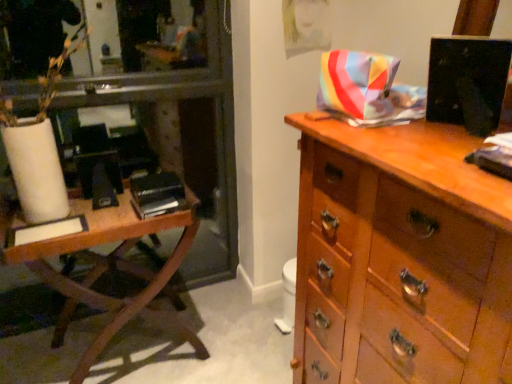
Find the location of a particular element. vacant point to the right of wooden table at left is located at coordinates (233, 335).